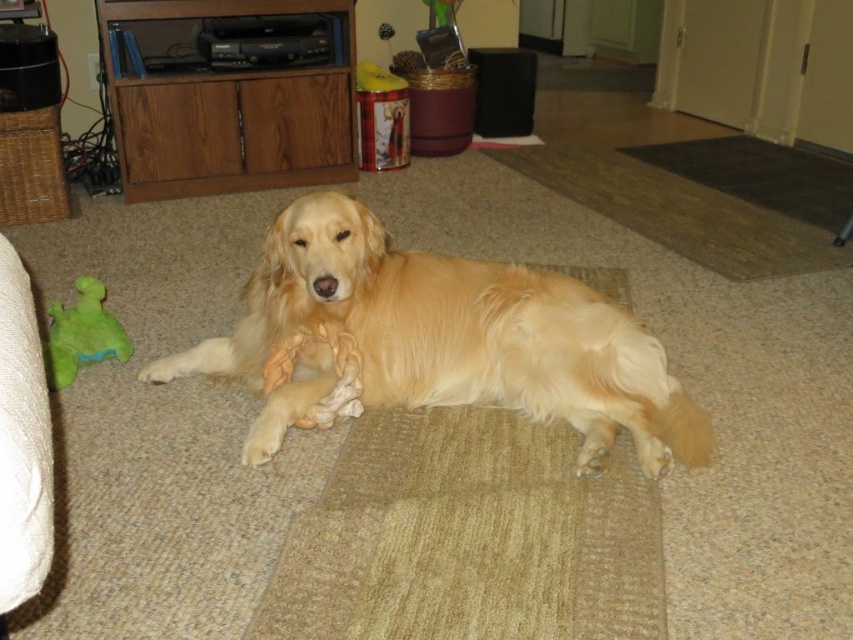
Question: Is golden fur dog at center behind green plush toy at left?

Choices:
 (A) yes
 (B) no

Answer: (B)

Question: Which point appears farthest from the camera in this image?

Choices:
 (A) (96, 282)
 (B) (300, 352)

Answer: (A)

Question: Which point is farther to the camera?

Choices:
 (A) (467, 355)
 (B) (51, 333)

Answer: (B)

Question: Does golden fur dog at center lie in front of green plush toy at left?

Choices:
 (A) yes
 (B) no

Answer: (A)

Question: Can you confirm if golden fur dog at center is thinner than green plush toy at left?

Choices:
 (A) no
 (B) yes

Answer: (A)